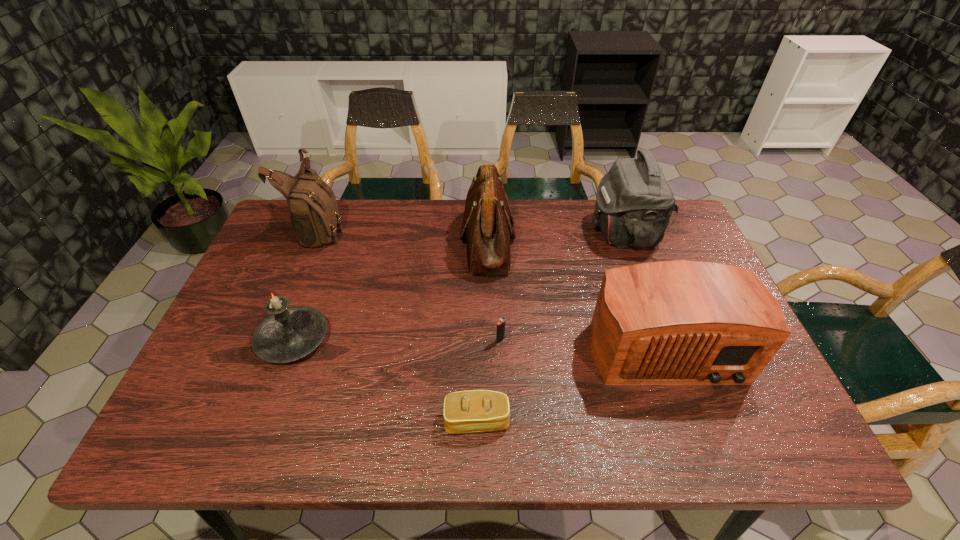
Find the location of a particular element. The image size is (960, 540). radio receiver positioned at the right edge is located at coordinates tap(682, 322).

Find the location of `object that is at the far left corner`. object that is at the far left corner is located at coordinates (314, 214).

Identify the location of object that is at the far right corner. This screenshot has height=540, width=960. (634, 203).

Where is `free spot at the far edge of the desktop`? This screenshot has width=960, height=540. free spot at the far edge of the desktop is located at coordinates (419, 239).

This screenshot has width=960, height=540. Identify the location of free region at the near edge. (485, 436).

Locate an element on the screen. This screenshot has height=540, width=960. blank area at the left edge is located at coordinates (265, 254).

At what (x,y) coordinates should I click in order to perform the action: click on vacant space at the far right corner of the desktop. Please return your answer as a coordinate pair (x, y). This screenshot has width=960, height=540. Looking at the image, I should click on (676, 225).

Identify the location of free spot between the nearest object and the rightmost shoulder bag. Image resolution: width=960 pixels, height=540 pixels. (550, 327).

You are a GUI agent. You are given a task and a screenshot of the screen. Output one action in this format:
    pyautogui.click(x=<x>, y=<y>)
    Task: Click on the vacant region between the third shortest object and the nearest object
    
    Given the screenshot: What is the action you would take?
    pyautogui.click(x=385, y=380)

Where is `unoccupied position between the rightmost shoulder bag and the sixth tallest object`? unoccupied position between the rightmost shoulder bag and the sixth tallest object is located at coordinates (562, 287).